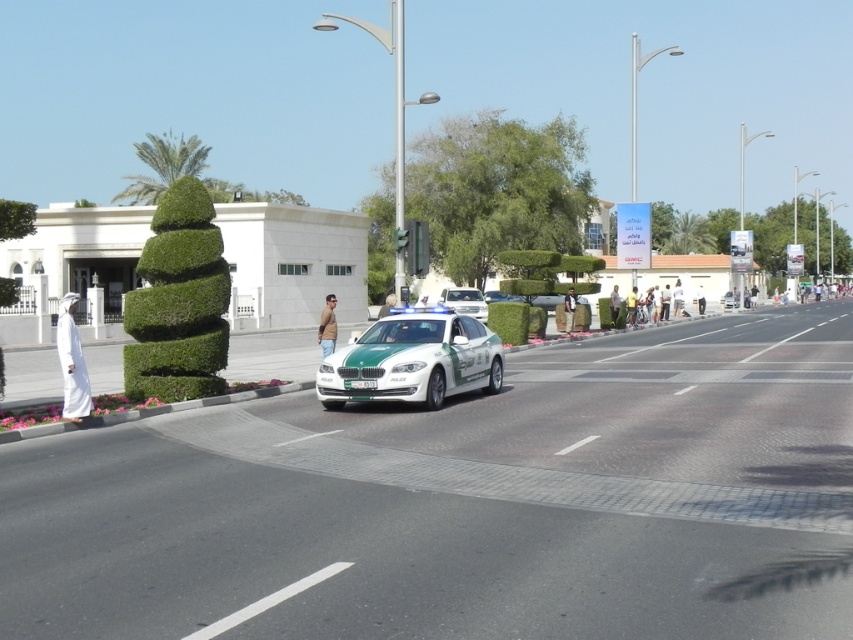
You are a delivery driver who needs to make a left turn onto a side street located at point (445, 285). The police car is currently at point (437, 404). Since you must wait for the police car to pass before turning, will you have enough time to turn before the traffic light turns red in 10 seconds? Assume the police car is moving at 20 kmph and your car can accelerate to 30 kmph for the turn.

Point (437, 404) is in front of point (445, 285). The police car is ahead of the turning point, so you can turn immediately without waiting. There is no need to wait for the police car to pass. You have enough time to make the left turn before the traffic light turns red in 10 seconds.

You are a pedestrian standing at the intersection and see the green matte police car at center and the white glossy sedan at center. If you want to cross the road, which vehicle is closer to you?

The green matte police car at center is closer to you since it is only 23.64 meters away from the white glossy sedan at center, but without knowing your exact position, it is difficult to determine the exact distance. However, since both vehicles are at the center, the police car might be in the middle of the road, making it closer to the intersection where you are standing.

You are a pedestrian at the intersection and see the green matte police car at center and the white glossy sedan at center. Which vehicle is closer to you?

The green matte police car at center is closer to you because it is positioned in front of the white glossy sedan at center.